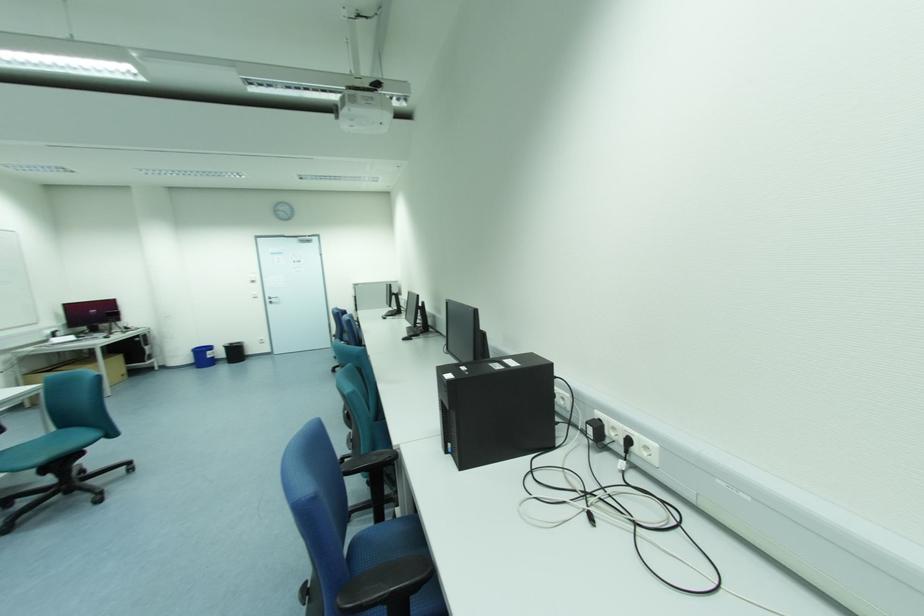
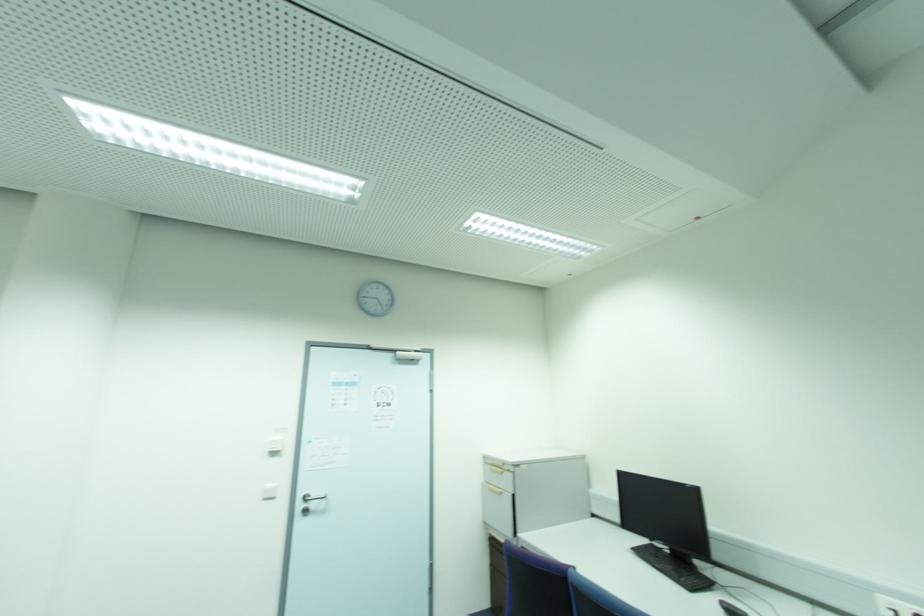
In the second image, find the point that corresponds to [272,299] in the first image.

(306, 500)